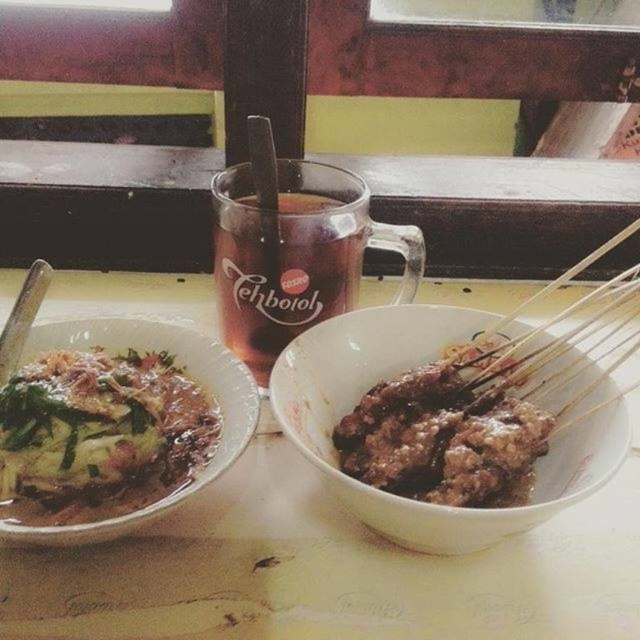
You are a food critic evaluating the presentation of the dishes on the table. Which item has a smaller size between the green matte vegetable at center and the brown wooden skewers at right?

The green matte vegetable at center is smaller than the brown wooden skewers at right.

You are a waiter standing at the edge of the table. You need to place a new dish exactly at the center of the table. The table has coordinates ranging from 0 to 1 on both axes. Where should you place the new dish to align it with the white glossy bowl at center located at point (x=397, y=372)?

The white glossy bowl at center is already located at point (x=397, y=372), so placing the new dish at the same coordinates would align it with the white glossy bowl at center.

You are a food critic evaluating the presentation of the dishes. Which object is wider, the green matte vegetable at center or the silver metallic chopstick at upper left?

The green matte vegetable at center is wider than the silver metallic chopstick at upper left according to the description.